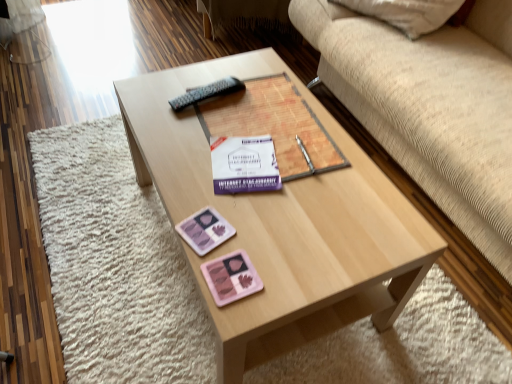
Where is `unoccupied area in front of purple matte book at center`? Image resolution: width=512 pixels, height=384 pixels. unoccupied area in front of purple matte book at center is located at coordinates (285, 226).